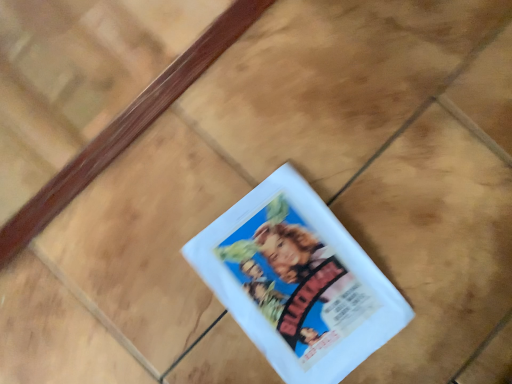
Locate an element on the screen. white paper at center is located at coordinates (298, 281).

The image size is (512, 384). What do you see at coordinates (298, 281) in the screenshot?
I see `white paper at center` at bounding box center [298, 281].

Find the location of a particular element. This screenshot has width=512, height=384. white paper at center is located at coordinates (298, 281).